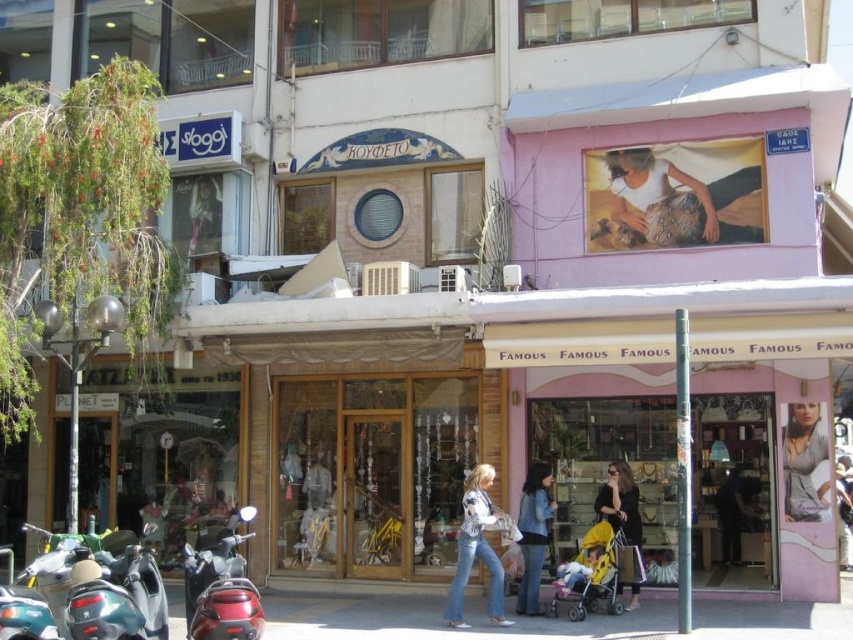
Between point (469, 540) and point (732, 557), which one is positioned behind?

Point (732, 557)

Is denim jeans at center below dark blue jeans at center?

Actually, denim jeans at center is above dark blue jeans at center.

Between point (480, 547) and point (721, 506), which one is positioned in front?

Point (480, 547)

Where is `denim jeans at center`? The width and height of the screenshot is (853, 640). denim jeans at center is located at coordinates (477, 547).

Can you confirm if matte white shirt at upper center is positioned above matte gray blouse at center?

Yes, matte white shirt at upper center is above matte gray blouse at center.

Is point (607, 157) closer to viewer compared to point (785, 429)?

No.

Locate an element on the screen. The image size is (853, 640). matte white shirt at upper center is located at coordinates (675, 195).

Which of these two, denim jeans at center or blue denim jeans at center, stands taller?

denim jeans at center is taller.

Can you confirm if denim jeans at center is positioned above blue denim jeans at center?

Actually, denim jeans at center is below blue denim jeans at center.

Which is behind, point (473, 492) or point (521, 515)?

The point (521, 515) is behind.

The width and height of the screenshot is (853, 640). In order to click on denim jeans at center in this screenshot , I will do `click(477, 547)`.